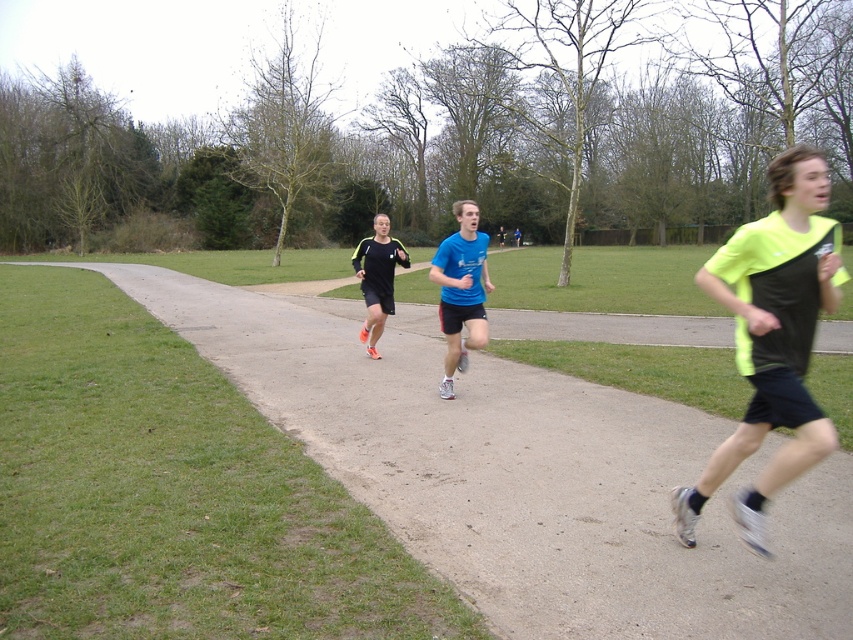
You are a runner preparing to cross the path. You see the smooth asphalt path at center and the neon yellow fabric at center. Which object is closer to you?

The smooth asphalt path at center is closer to you because the neon yellow fabric at center is behind it.

You are standing at the starting line of a 5K race and see the smooth asphalt path at center ahead of you. If you need to reach the path within 5 seconds, what is the minimum speed you must maintain?

The smooth asphalt path at center is 3.47 meters away. To cover this distance in 5 seconds, you must maintain a minimum speed of approximately 0.694 meters per second.